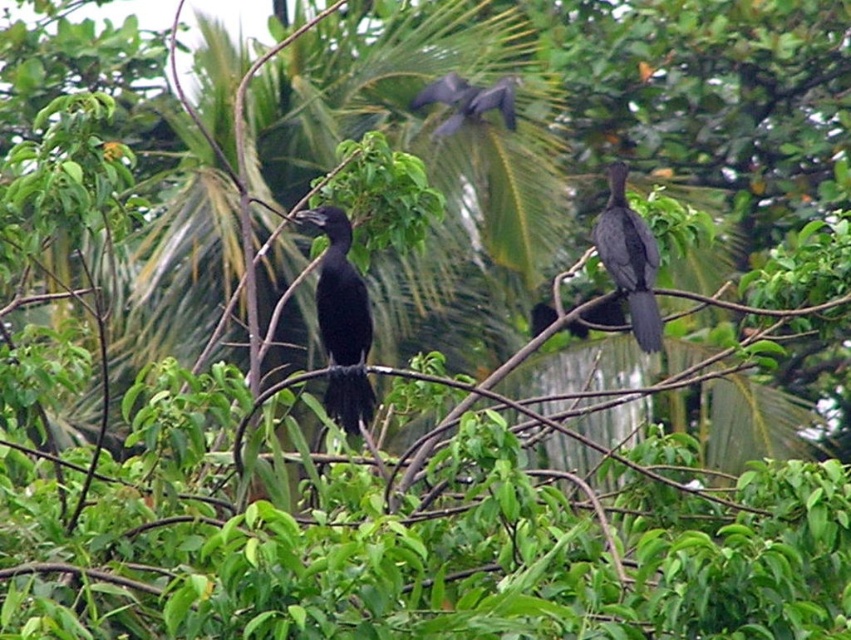
You are a photographer aiming to capture both the shiny black bird at right and the shiny black bird at upper center in a single shot. Which bird will appear larger in your photo?

The shiny black bird at right will appear larger in the photo because it is closer to the viewer than the shiny black bird at upper center.

You are an ornithologist observing the birds in the scene. You notice two birds of interest. The first is the black matte bird at center, and the second is the shiny black bird at upper center. Which of these two birds is positioned higher in the image?

The shiny black bird at upper center is positioned higher in the image than the black matte bird at center.

You are observing two points in the scene with coordinates point (318, 221) and point (637, 257). Which point is nearer to you?

Point (318, 221) is closer to the viewer than point (637, 257).